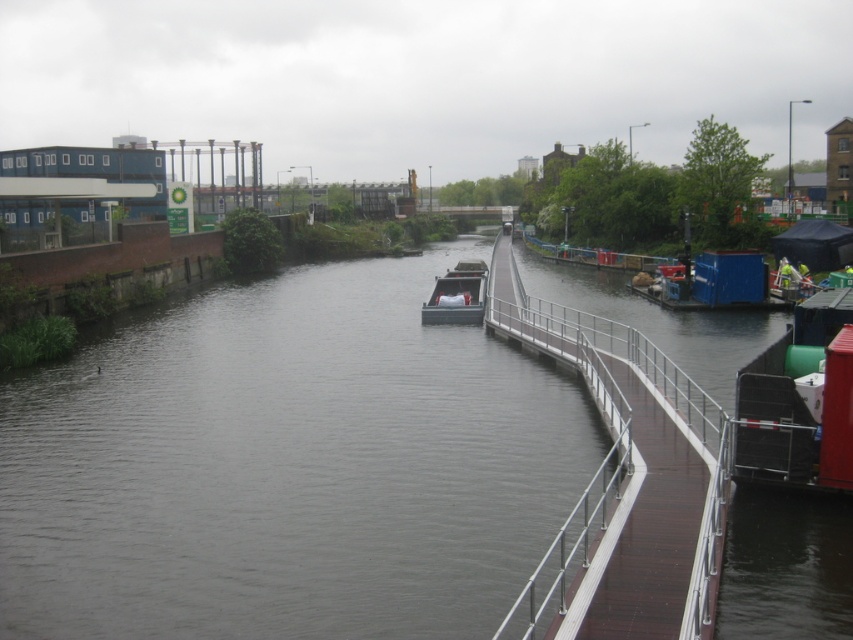
You are standing on the wooden pedestrian bridge on the right side of the canal and want to locate the dark gray water at center. According to the coordinates provided, where should you look relative to your position?

The dark gray water at center is located at coordinates point (285, 467), so you should look towards the lower middle area from your position on the wooden pedestrian bridge on the right side of the canal.

You are a delivery drone carrying a package that requires a flat landing area. You observe the dark gray water at center and the dark gray metallic boat at center in the scene. Which location would provide a suitable landing spot based on their sizes?

The dark gray water at center is bigger than the dark gray metallic boat at center, so the water would provide a larger and more suitable landing area for the drone.

You are standing on the pedestrian bridge and want to take a photo of both the dark gray water at center and the dark gray metallic boat at center. Which object will appear larger in your photo?

The dark gray water at center will appear larger in the photo because it is closer to the viewer than the dark gray metallic boat at center.